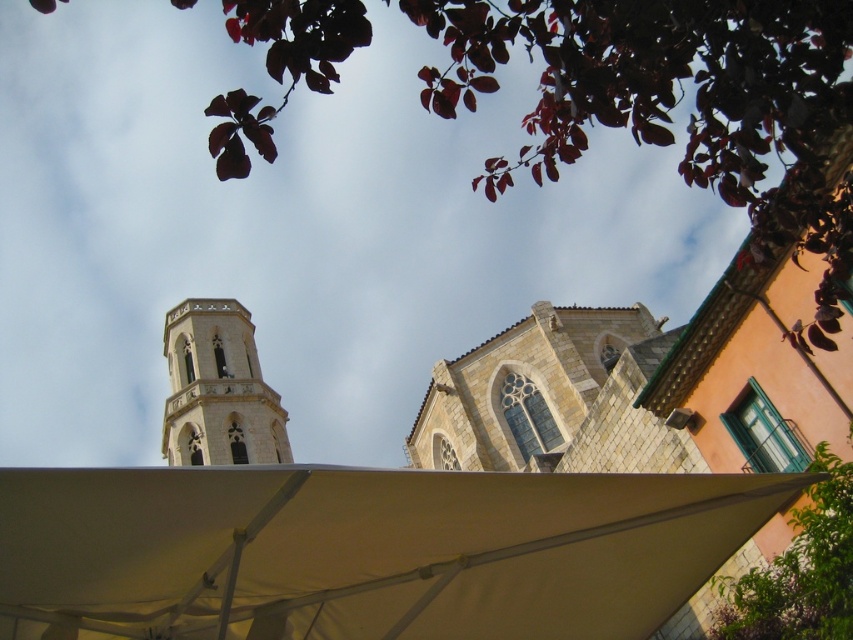
What do you see at coordinates (364, 550) in the screenshot? The height and width of the screenshot is (640, 853). I see `white fabric canopy at center` at bounding box center [364, 550].

I want to click on white fabric canopy at center, so click(364, 550).